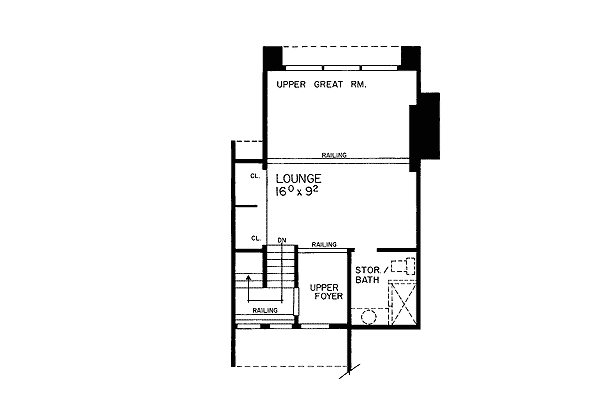
This screenshot has width=600, height=403. Find the location of `upper foyer`. upper foyer is located at coordinates (320, 290), (319, 298).